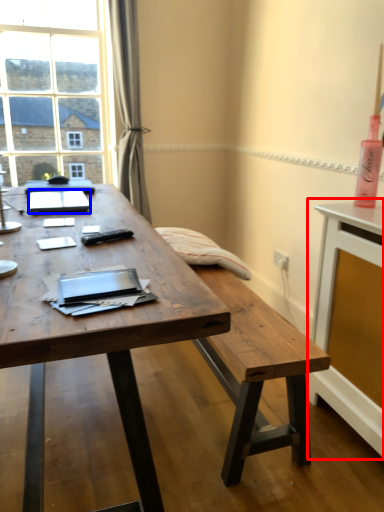
Question: Which object appears closest to the camera in this image, computer desk (highlighted by a red box) or notebook (highlighted by a blue box)?

Choices:
 (A) computer desk
 (B) notebook

Answer: (A)